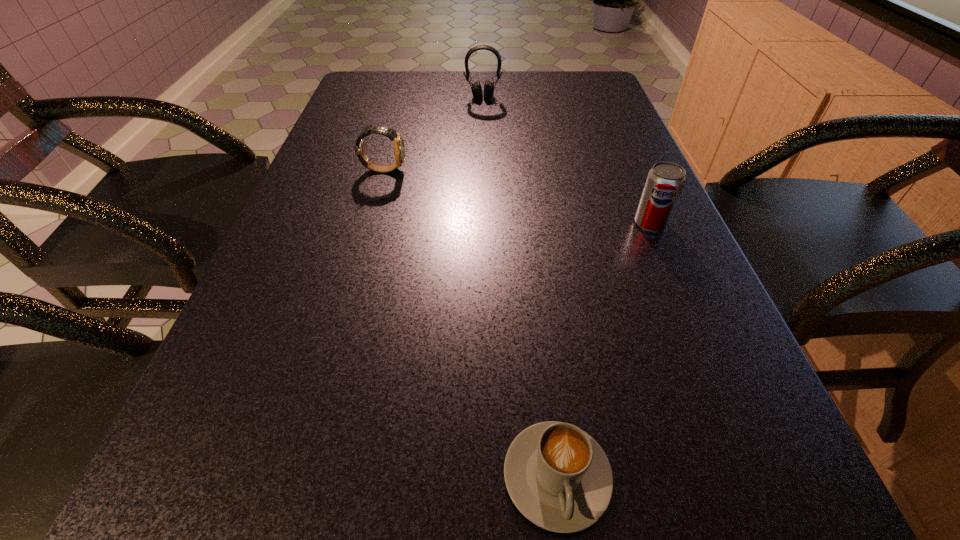
Locate an element on the screen. Image resolution: width=960 pixels, height=540 pixels. object that is positioned at the far edge is located at coordinates (476, 88).

I want to click on object located in the left edge section of the desktop, so click(x=399, y=149).

You are a GUI agent. You are given a task and a screenshot of the screen. Output one action in this format:
    pyautogui.click(x=<x>, y=<y>)
    Task: Click on the object present at the right edge
    This screenshot has height=540, width=960.
    Given the screenshot: What is the action you would take?
    pyautogui.click(x=665, y=181)

Find the location of a particular element. free space at the far edge of the desktop is located at coordinates (542, 98).

This screenshot has height=540, width=960. What are the coordinates of `vacant area at the near edge of the desktop` in the screenshot? It's located at (339, 539).

Where is `free space at the left edge of the desktop`? This screenshot has width=960, height=540. free space at the left edge of the desktop is located at coordinates (320, 230).

Identify the location of vacant point at the right edge. The height and width of the screenshot is (540, 960). (626, 135).

Find the location of a particular element. The image size is (960, 540). empty space that is in between the second farthest object and the farthest object is located at coordinates (433, 133).

At what (x,y) coordinates should I click in order to perform the action: click on vacant area that lies between the farthest object and the nearest object. Please return your answer as a coordinate pair (x, y). The width and height of the screenshot is (960, 540). Looking at the image, I should click on (520, 286).

Locate an element on the screen. empty space between the headset and the nearest object is located at coordinates (520, 286).